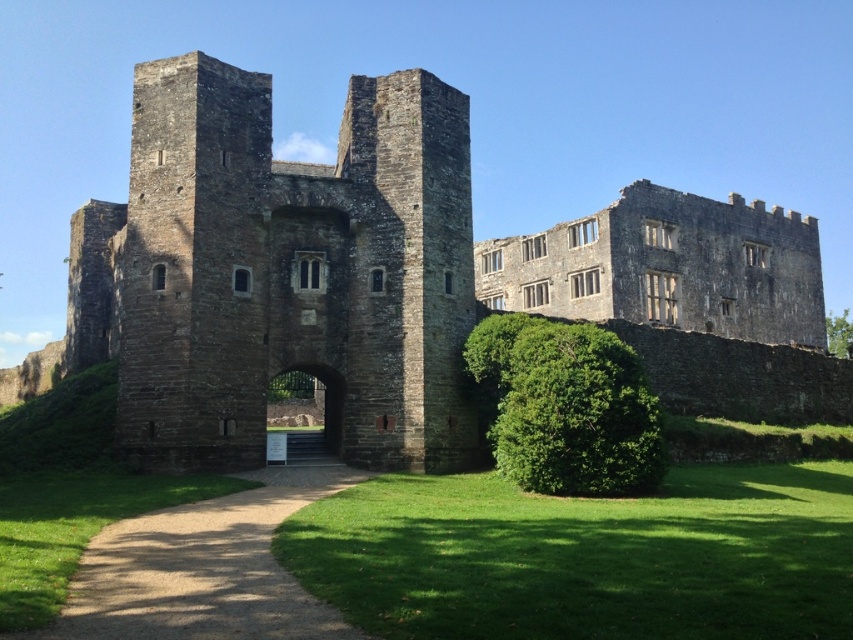
Question: From the image, what is the correct spatial relationship of brown gravel path at center in relation to green leafy hedge at center?

Choices:
 (A) left
 (B) right

Answer: (A)

Question: Does brown stone castle at center have a smaller size compared to green leafy hedge at center?

Choices:
 (A) yes
 (B) no

Answer: (B)

Question: Which point is farther from the camera taking this photo?

Choices:
 (A) (194, 595)
 (B) (248, 99)
 (C) (573, 419)

Answer: (B)

Question: Which object is farther from the camera taking this photo?

Choices:
 (A) brown gravel path at center
 (B) green leafy hedge at center
 (C) brown stone castle at center

Answer: (C)

Question: Observing the image, what is the correct spatial positioning of brown stone castle at center in reference to brown gravel path at center?

Choices:
 (A) below
 (B) above

Answer: (B)

Question: Estimate the real-world distances between objects in this image. Which object is closer to the green leafy hedge at center?

Choices:
 (A) brown gravel path at center
 (B) brown stone castle at center

Answer: (A)